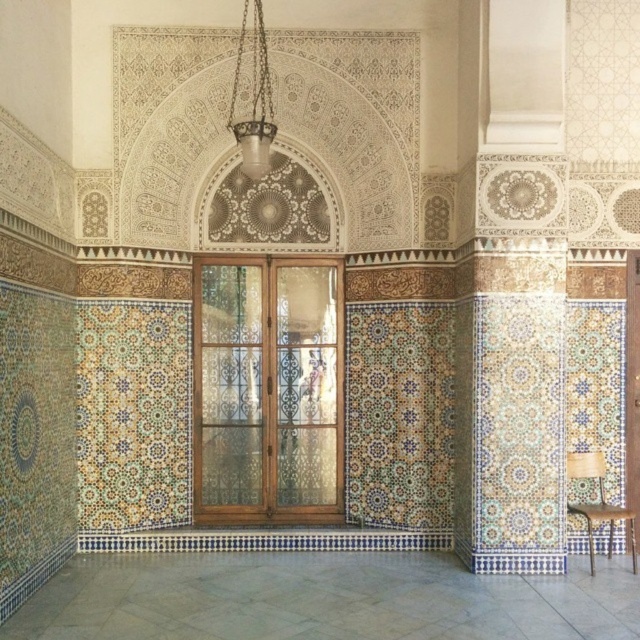
Can you confirm if clear glass door at center is shorter than wooden chair at lower right?

No.

Does clear glass door at center have a larger size compared to wooden chair at lower right?

Correct, clear glass door at center is larger in size than wooden chair at lower right.

Is point (292, 372) positioned after point (618, 516)?

Yes, point (292, 372) is behind point (618, 516).

This screenshot has height=640, width=640. Identify the location of clear glass door at center. (268, 388).

Can you confirm if metallic gold chandelier at upper center is wider than wooden chair at lower right?

Answer: No, metallic gold chandelier at upper center is not wider than wooden chair at lower right.

Is metallic gold chandelier at upper center below wooden chair at lower right?

No, metallic gold chandelier at upper center is not below wooden chair at lower right.

This screenshot has height=640, width=640. What do you see at coordinates (253, 100) in the screenshot?
I see `metallic gold chandelier at upper center` at bounding box center [253, 100].

Where is `metallic gold chandelier at upper center`? The height and width of the screenshot is (640, 640). metallic gold chandelier at upper center is located at coordinates (253, 100).

What do you see at coordinates (268, 388) in the screenshot? This screenshot has width=640, height=640. I see `clear glass door at center` at bounding box center [268, 388].

Does clear glass door at center have a lesser height compared to metallic gold chandelier at upper center?

No, clear glass door at center is not shorter than metallic gold chandelier at upper center.

Locate an element on the screen. clear glass door at center is located at coordinates (268, 388).